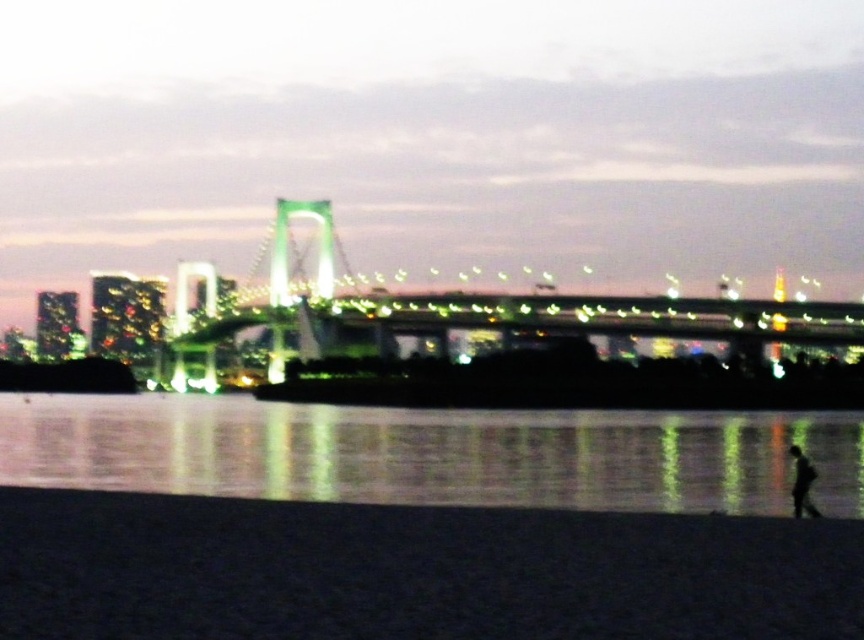
What do you see at coordinates (413, 572) in the screenshot?
I see `dark sand at lower center` at bounding box center [413, 572].

Does dark sand at lower center appear over reflective glass water at lower center?

Yes.

Identify the location of dark sand at lower center. (413, 572).

Image resolution: width=864 pixels, height=640 pixels. What do you see at coordinates (413, 572) in the screenshot?
I see `dark sand at lower center` at bounding box center [413, 572].

How far apart are dark sand at lower center and green metallic bridge at center?

The distance of dark sand at lower center from green metallic bridge at center is 318.33 meters.

Who is more distant from viewer, (397, 595) or (325, 204)?

The point (325, 204) is behind.

This screenshot has height=640, width=864. I want to click on dark sand at lower center, so click(413, 572).

Who is lower down, reflective glass water at lower center or black matte figure at lower right?

reflective glass water at lower center is lower down.

From the picture: Can you confirm if reflective glass water at lower center is wider than black matte figure at lower right?

Correct, the width of reflective glass water at lower center exceeds that of black matte figure at lower right.

Between point (499, 488) and point (810, 483), which one is positioned behind?

The point (499, 488) is more distant.

This screenshot has width=864, height=640. I want to click on reflective glass water at lower center, so click(430, 452).